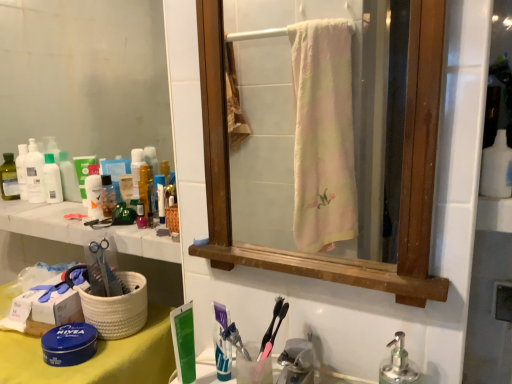
Describe the element at coordinates (496, 168) in the screenshot. I see `white matte bottle at upper right` at that location.

What do you see at coordinates (84, 76) in the screenshot? The image size is (512, 384). I see `white plastic bottles at upper left` at bounding box center [84, 76].

Locate an element on the screen. The height and width of the screenshot is (384, 512). white plastic bottles at upper left is located at coordinates (84, 76).

Locate an element on the screen. This screenshot has width=512, height=384. white marble counter at upper left is located at coordinates (82, 229).

The image size is (512, 384). What do you see at coordinates (108, 196) in the screenshot? I see `translucent plastic bottle at upper left, the 1th mouthwash positioned from the front` at bounding box center [108, 196].

This screenshot has height=384, width=512. Describe the element at coordinates (222, 342) in the screenshot. I see `white glossy toothpaste at center` at that location.

How much space does translucent plastic mouthwash at left, which is the first mouthwash from left to right, occupy vertically?

8.44 inches.

Find the location of a particular element. The width and height of the screenshot is (512, 384). white matte bottle at upper right is located at coordinates (496, 168).

Between matte white lotion at left, the second toiletry viewed from the left, and white plastic bottles at upper left, which one has smaller size?

With smaller size is matte white lotion at left, the second toiletry viewed from the left.

Who is shorter, matte white lotion at left, marked as the first toiletry in a right-to-left arrangement, or white plastic bottles at upper left?

matte white lotion at left, marked as the first toiletry in a right-to-left arrangement.

Is matte white lotion at left, marked as the first toiletry in a right-to-left arrangement, inside the boundaries of white plastic bottles at upper left, or outside?

matte white lotion at left, marked as the first toiletry in a right-to-left arrangement, is located beyond the bounds of white plastic bottles at upper left.

Does matte white lotion at left, the second toiletry viewed from the left, come behind white plastic bottles at upper left?

Yes, it is behind white plastic bottles at upper left.

Is matte white lotion at left, the second toiletry viewed from the left, placed right next to translucent plastic mouthwash at left, which is the first mouthwash from left to right?

Yes, matte white lotion at left, the second toiletry viewed from the left, is in contact with translucent plastic mouthwash at left, which is the first mouthwash from left to right.

Considering the sizes of objects matte white lotion at left, marked as the first toiletry in a right-to-left arrangement, and translucent plastic mouthwash at left, which is counted as the 1th mouthwash, starting from the back, in the image provided, who is shorter, matte white lotion at left, marked as the first toiletry in a right-to-left arrangement, or translucent plastic mouthwash at left, which is counted as the 1th mouthwash, starting from the back,?

matte white lotion at left, marked as the first toiletry in a right-to-left arrangement, is shorter.

Which of these two, matte white lotion at left, the second toiletry viewed from the left, or translucent plastic mouthwash at left, which is the first mouthwash from left to right, is bigger?

translucent plastic mouthwash at left, which is the first mouthwash from left to right.

Are translucent plastic bottles at left, the first toiletry positioned from the left, and silver metallic soap dispenser at lower right located far from each other?

Yes, translucent plastic bottles at left, the first toiletry positioned from the left, and silver metallic soap dispenser at lower right are quite far apart.

Is translucent plastic bottles at left, which ranks as the second toiletry in right-to-left order, completely or partially outside of silver metallic soap dispenser at lower right?

translucent plastic bottles at left, which ranks as the second toiletry in right-to-left order, lies outside silver metallic soap dispenser at lower right's area.

From their relative heights in the image, would you say translucent plastic bottles at left, which ranks as the second toiletry in right-to-left order, is taller or shorter than silver metallic soap dispenser at lower right?

Clearly, translucent plastic bottles at left, which ranks as the second toiletry in right-to-left order, is shorter compared to silver metallic soap dispenser at lower right.

From a real-world perspective, is translucent plastic bottles at left, the first toiletry positioned from the left, physically located above or below silver metallic soap dispenser at lower right?

translucent plastic bottles at left, the first toiletry positioned from the left, is situated higher than silver metallic soap dispenser at lower right in the real world.

Is translucent plastic bottles at left, the first toiletry positioned from the left, behind translucent plastic bottle at upper left, acting as the 2th mouthwash starting from the back?

A: That is True.

From the image's perspective, relative to translucent plastic bottle at upper left, which ranks as the 2th mouthwash in left-to-right order, is translucent plastic bottles at left, the first toiletry positioned from the left, above or below?

translucent plastic bottles at left, the first toiletry positioned from the left, is situated higher than translucent plastic bottle at upper left, which ranks as the 2th mouthwash in left-to-right order, in the image.

How many degrees apart are the facing directions of translucent plastic bottles at left, the first toiletry positioned from the left, and translucent plastic bottle at upper left, the 1th mouthwash positioned from the front?

0.000579 degrees.

In the scene shown: Is translucent plastic bottles at left, which ranks as the second toiletry in right-to-left order, inside or outside of translucent plastic bottle at upper left, which ranks as the 2th mouthwash in left-to-right order?

translucent plastic bottles at left, which ranks as the second toiletry in right-to-left order, is spatially situated outside translucent plastic bottle at upper left, which ranks as the 2th mouthwash in left-to-right order.

Which point is more distant from viewer, [2,177] or [78,223]?

Positioned behind is point [2,177].

Consider the image. Is translucent plastic bottles at left, the first toiletry positioned from the left, positioned with its back to white marble counter at upper left?

No, translucent plastic bottles at left, the first toiletry positioned from the left, is not facing away from white marble counter at upper left.

From the image's perspective, which object appears higher, translucent plastic bottles at left, which ranks as the second toiletry in right-to-left order, or white marble counter at upper left?

translucent plastic bottles at left, which ranks as the second toiletry in right-to-left order, from the image's perspective.

Considering the sizes of objects matte white lotion at left, marked as the first toiletry in a right-to-left arrangement, and white glossy toothpaste at center in the image provided, who is smaller, matte white lotion at left, marked as the first toiletry in a right-to-left arrangement, or white glossy toothpaste at center?

Smaller between the two is white glossy toothpaste at center.

Is matte white lotion at left, marked as the first toiletry in a right-to-left arrangement, oriented towards white glossy toothpaste at center?

No, matte white lotion at left, marked as the first toiletry in a right-to-left arrangement, is not oriented towards white glossy toothpaste at center.

In the image, is matte white lotion at left, the second toiletry viewed from the left, on the left side or the right side of white glossy toothpaste at center?

From the image, it's evident that matte white lotion at left, the second toiletry viewed from the left, is to the left of white glossy toothpaste at center.

The image size is (512, 384). In the image, there is a matte white lotion at left, the second toiletry viewed from the left. Identify the location of toothpaste below it (from the image's perspective). (222, 342).

Considering the relative sizes of translucent plastic mouthwash at left, which is counted as the 1th mouthwash, starting from the back, and translucent plastic bottle at upper left, acting as the 2th mouthwash starting from the back, in the image provided, is translucent plastic mouthwash at left, which is counted as the 1th mouthwash, starting from the back, shorter than translucent plastic bottle at upper left, acting as the 2th mouthwash starting from the back,?

No, translucent plastic mouthwash at left, which is counted as the 1th mouthwash, starting from the back, is not shorter than translucent plastic bottle at upper left, acting as the 2th mouthwash starting from the back.

From a real-world perspective, is translucent plastic mouthwash at left, the second mouthwash from the right, under translucent plastic bottle at upper left, the 1th mouthwash positioned from the front?

Incorrect, from a real-world perspective, translucent plastic mouthwash at left, the second mouthwash from the right, is higher than translucent plastic bottle at upper left, the 1th mouthwash positioned from the front.

At what (x,y) coordinates should I click in order to perform the action: click on mouthwash in front of the translucent plastic mouthwash at left, which is the first mouthwash from left to right. Please return your answer as a coordinate pair (x, y). This screenshot has width=512, height=384. Looking at the image, I should click on (108, 196).

Is translucent plastic mouthwash at left, which ranks as the second mouthwash in front-to-back order, beside translucent plastic bottle at upper left, which ranks as the 2th mouthwash in left-to-right order?

translucent plastic mouthwash at left, which ranks as the second mouthwash in front-to-back order, and translucent plastic bottle at upper left, which ranks as the 2th mouthwash in left-to-right order, are clearly separated.

At what (x,y) coordinates should I click in order to perform the action: click on mirror on the right of matte white lotion at left, the second toiletry viewed from the left. Please return your answer as a coordinate pair (x, y). This screenshot has height=384, width=512. Looking at the image, I should click on (84, 76).

This screenshot has width=512, height=384. Find the location of `mouthwash located above the matte white lotion at left, marked as the first toiletry in a right-to-left arrangement (from a real-world perspective)`. mouthwash located above the matte white lotion at left, marked as the first toiletry in a right-to-left arrangement (from a real-world perspective) is located at coordinates (34, 173).

Estimate the real-world distances between objects in this image. Which object is closer to matte white lotion at left, marked as the first toiletry in a right-to-left arrangement, white plastic bottles at upper left or white glossy toothpaste at center?

white plastic bottles at upper left is positioned closer to the anchor matte white lotion at left, marked as the first toiletry in a right-to-left arrangement.

Which object lies further to the anchor point translucent plastic bottles at left, the first toiletry positioned from the left, translucent plastic mouthwash at left, which is counted as the 1th mouthwash, starting from the back, or matte white lotion at left, marked as the first toiletry in a right-to-left arrangement?

matte white lotion at left, marked as the first toiletry in a right-to-left arrangement, is further to translucent plastic bottles at left, the first toiletry positioned from the left.

Looking at the image, which one is located closer to white marble counter at upper left, translucent plastic bottles at left, the first toiletry positioned from the left, or white matte bottle at upper right?

translucent plastic bottles at left, the first toiletry positioned from the left, is positioned closer to the anchor white marble counter at upper left.

Based on their spatial positions, is white glossy toothpaste at center or white plastic bottles at upper left closer to white marble counter at upper left?

Among the two, white plastic bottles at upper left is located nearer to white marble counter at upper left.

Looking at the image, which one is located closer to white marble counter at upper left, white plastic bottles at upper left or translucent plastic bottles at left, the first toiletry positioned from the left?

white plastic bottles at upper left lies closer to white marble counter at upper left than the other object.

Looking at the image, which one is located closer to white marble counter at upper left, translucent plastic mouthwash at left, the second mouthwash from the right, or white plastic bottles at upper left?

translucent plastic mouthwash at left, the second mouthwash from the right, lies closer to white marble counter at upper left than the other object.

When comparing their distances from white marble counter at upper left, does translucent plastic bottle at upper left, acting as the 2th mouthwash starting from the back, or matte white lotion at left, marked as the first toiletry in a right-to-left arrangement, seem further?

matte white lotion at left, marked as the first toiletry in a right-to-left arrangement, is positioned further to the anchor white marble counter at upper left.

When comparing their distances from silver metallic soap dispenser at lower right, does white glossy toothpaste at center or white marble counter at upper left seem further?

Based on the image, white marble counter at upper left appears to be further to silver metallic soap dispenser at lower right.

The height and width of the screenshot is (384, 512). I want to click on counter between translucent plastic mouthwash at left, which is the first mouthwash from left to right, and silver metallic soap dispenser at lower right, in the horizontal direction, so (x=82, y=229).

Image resolution: width=512 pixels, height=384 pixels. Identify the location of mouthwash situated between matte white lotion at left, the second toiletry viewed from the left, and white matte bottle at upper right from left to right. (108, 196).

The height and width of the screenshot is (384, 512). Find the location of `mirror situated between translucent plastic mouthwash at left, which is the first mouthwash from left to right, and white matte bottle at upper right from left to right`. mirror situated between translucent plastic mouthwash at left, which is the first mouthwash from left to right, and white matte bottle at upper right from left to right is located at coordinates (84, 76).

You are a GUI agent. You are given a task and a screenshot of the screen. Output one action in this format:
    pyautogui.click(x=<x>, y=<y>)
    Task: Click on the counter between translucent plastic mouthwash at left, the second mouthwash from the right, and white glossy toothpaste at center from left to right
    The image size is (512, 384).
    Given the screenshot: What is the action you would take?
    pyautogui.click(x=82, y=229)